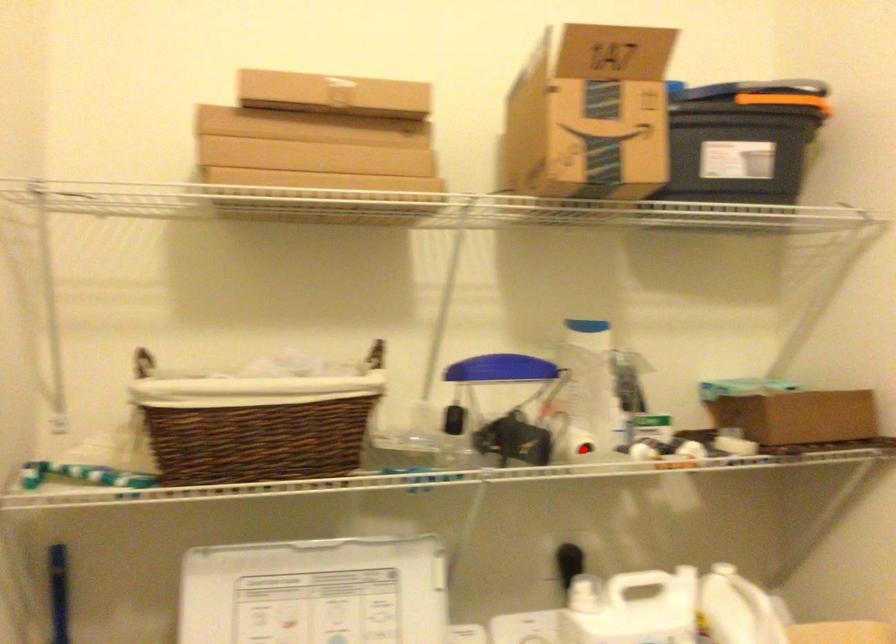
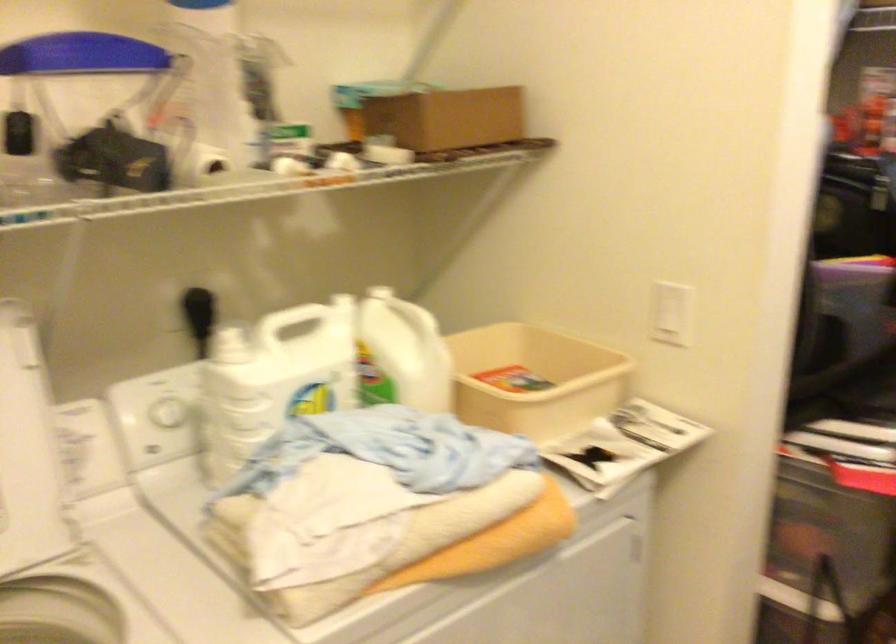
Question: I am providing you with two images of the same scene from different viewpoints. A red point is shown in image1. For the corresponding object point in image2, is it positioned nearer or farther from the camera?

Choices:
 (A) Nearer
 (B) Farther

Answer: (A)